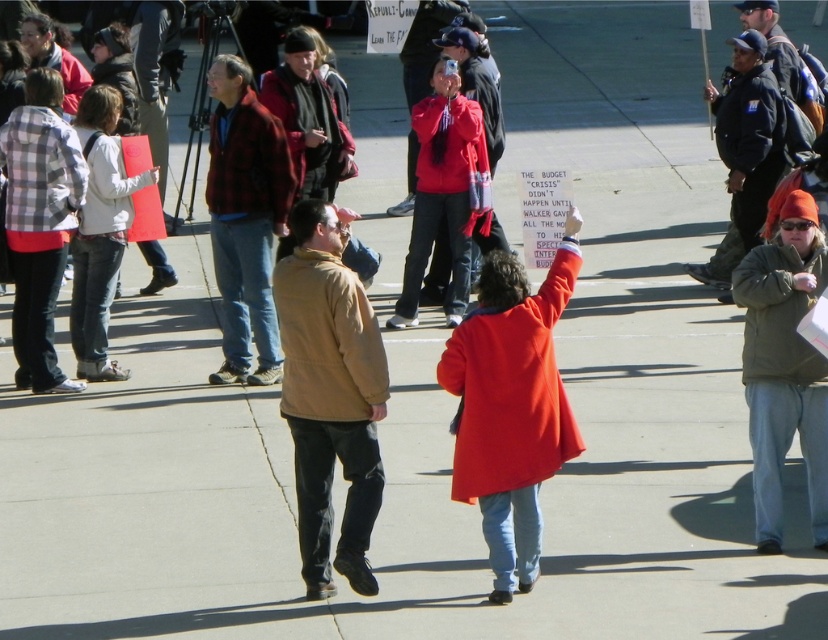
Question: Among these points, which one is farthest from the camera?

Choices:
 (A) (490, 346)
 (B) (367, 360)

Answer: (B)

Question: Can you confirm if green fuzzy jacket at lower right is smaller than red fleece jacket at center?

Choices:
 (A) yes
 (B) no

Answer: (A)

Question: Can you confirm if plaid flannel shirt at left is positioned to the left of white matte jacket at left?

Choices:
 (A) yes
 (B) no

Answer: (A)

Question: Based on their relative distances, which object is nearer to the flannel shirt at left?

Choices:
 (A) red fleece jacket at center
 (B) matte red coat at center
 (C) brown matte jacket at center

Answer: (A)

Question: Which object appears closest to the camera in this image?

Choices:
 (A) red fleece jacket at center
 (B) white matte jacket at left

Answer: (B)

Question: Can you confirm if flannel shirt at left is wider than white matte jacket at left?

Choices:
 (A) no
 (B) yes

Answer: (A)